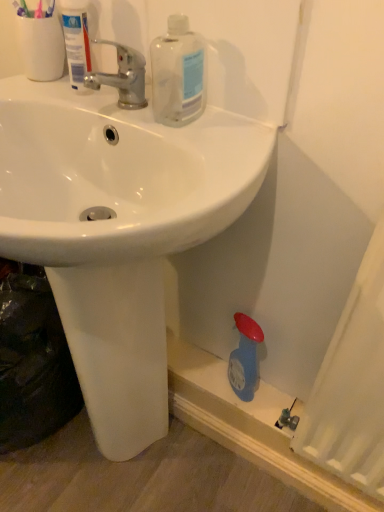
I want to click on vacant space in front of transparent plastic bottle at upper center, so click(198, 149).